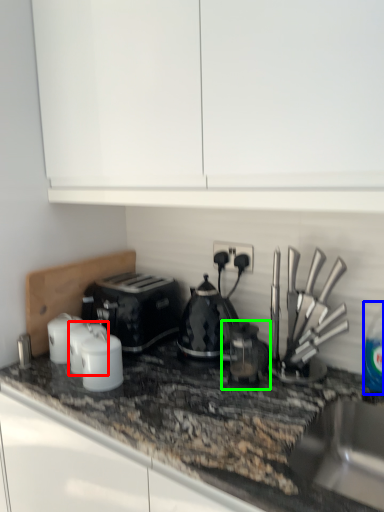
Question: Which object is the closest to the kitchen appliance (highlighted by a red box)? Choose among these: bottle (highlighted by a blue box) or coffee machine (highlighted by a green box).

Choices:
 (A) bottle
 (B) coffee machine

Answer: (B)